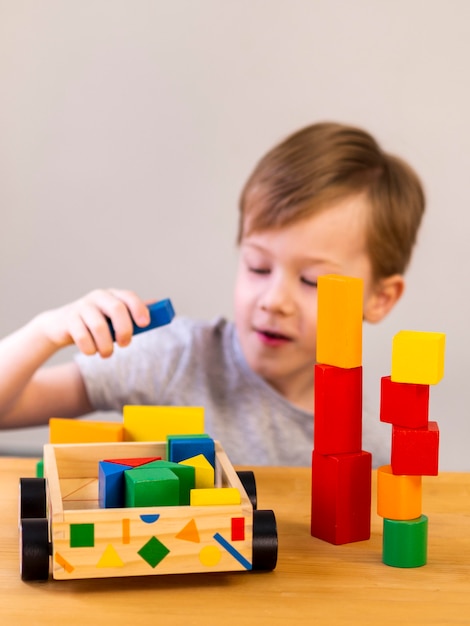
Identify the location of table. The height and width of the screenshot is (626, 470). [x=8, y=480], [x=111, y=610], [x=293, y=595], [x=301, y=499], [x=360, y=551], [x=447, y=485], [x=440, y=606].